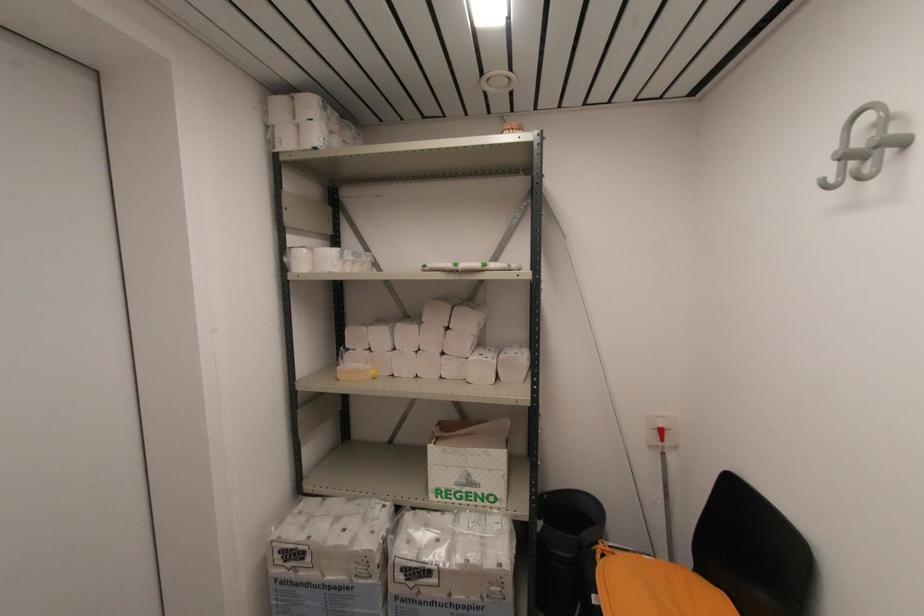
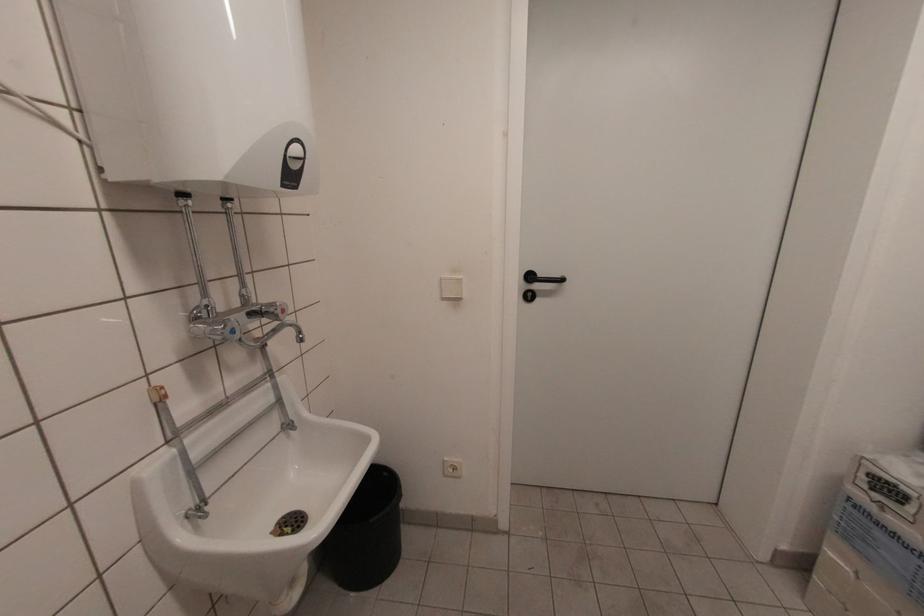
Based on the continuous images, in which direction is the camera rotating?

The rotation direction of the camera is left-down.